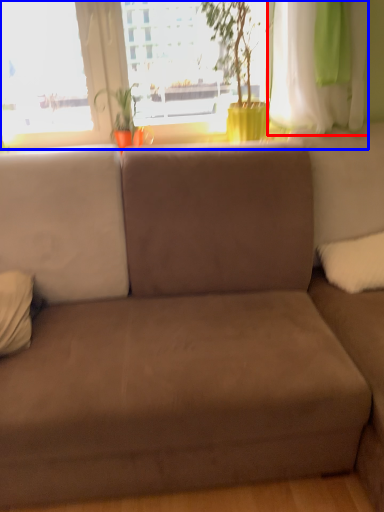
Question: Which object is further to the camera taking this photo, curtain (highlighted by a red box) or window (highlighted by a blue box)?

Choices:
 (A) curtain
 (B) window

Answer: (B)